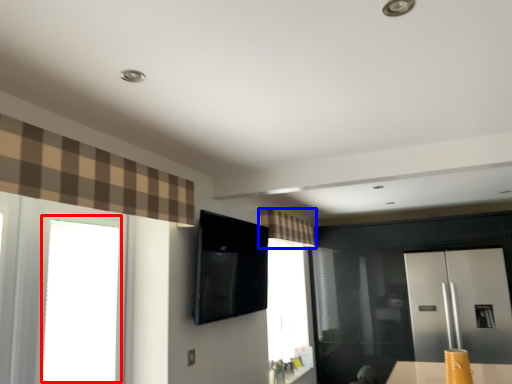
Question: Which point is further to the camera, window (highlighted by a red box) or curtain (highlighted by a blue box)?

Choices:
 (A) window
 (B) curtain

Answer: (B)